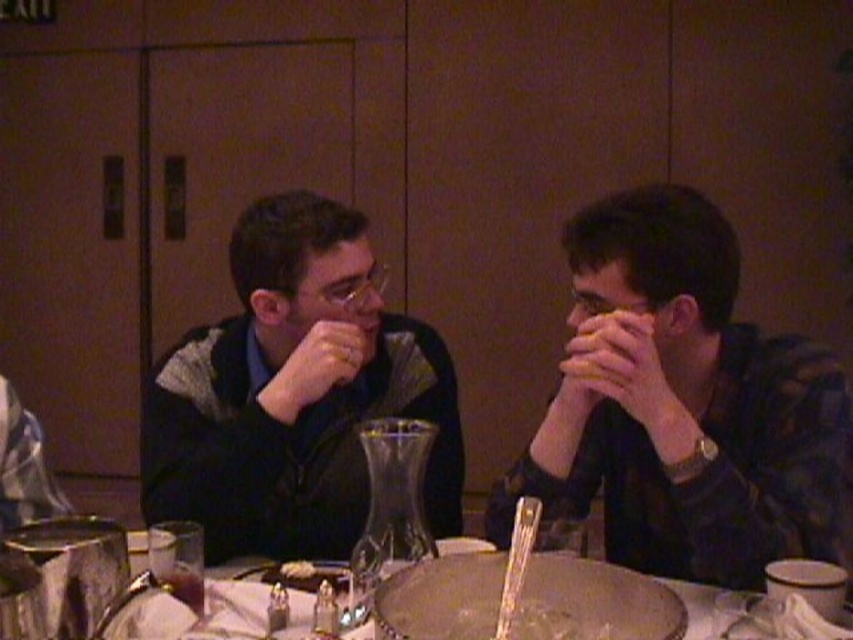
Between dark plaid shirt at center and white glossy table at center, which one appears on the left side from the viewer's perspective?

From the viewer's perspective, white glossy table at center appears more on the left side.

Can you confirm if dark plaid shirt at center is positioned below white glossy table at center?

No.

You are a GUI agent. You are given a task and a screenshot of the screen. Output one action in this format:
    pyautogui.click(x=<x>, y=<y>)
    Task: Click on the dark plaid shirt at center
    Image resolution: width=853 pixels, height=640 pixels.
    Given the screenshot: What is the action you would take?
    pyautogui.click(x=685, y=410)

The width and height of the screenshot is (853, 640). What are the coordinates of `dark plaid shirt at center` in the screenshot? It's located at (685, 410).

Is white matte bread at center behind white crumbly food at center?

No, white matte bread at center is closer to the viewer.

Is point (631, 384) positioned behind point (297, 577)?

No, (631, 384) is closer to viewer.

You are a GUI agent. You are given a task and a screenshot of the screen. Output one action in this format:
    pyautogui.click(x=<x>, y=<y>)
    Task: Click on the white matte bread at center
    The image size is (853, 640).
    Given the screenshot: What is the action you would take?
    pyautogui.click(x=611, y=349)

Is white matte bread at center to the right of clear glass at lower left from the viewer's perspective?

Indeed, white matte bread at center is positioned on the right side of clear glass at lower left.

Is white matte bread at center positioned in front of clear glass at lower left?

No, white matte bread at center is further to the viewer.

Describe the element at coordinates (611, 349) in the screenshot. I see `white matte bread at center` at that location.

The height and width of the screenshot is (640, 853). Find the location of `white matte bread at center`. white matte bread at center is located at coordinates (611, 349).